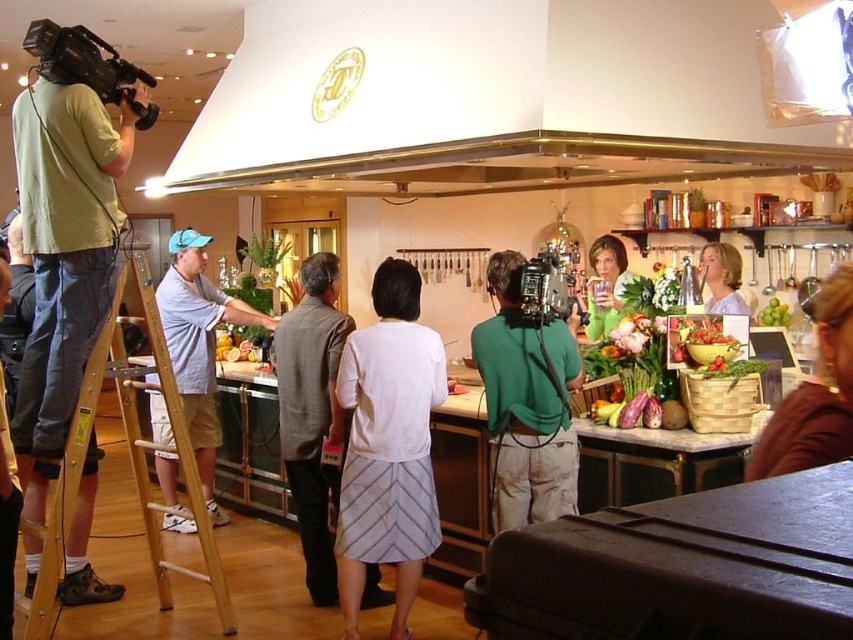
Can you confirm if white textured shirt at center is positioned above wooden ladder at left?

Yes, white textured shirt at center is above wooden ladder at left.

Find the location of a particular element. The height and width of the screenshot is (640, 853). white textured shirt at center is located at coordinates (387, 445).

Who is shorter, black matte video camera at upper left or green leafy vegetables at center?

Standing shorter between the two is green leafy vegetables at center.

Can you confirm if black matte video camera at upper left is positioned to the left of green leafy vegetables at center?

Correct, you'll find black matte video camera at upper left to the left of green leafy vegetables at center.

The height and width of the screenshot is (640, 853). I want to click on black matte video camera at upper left, so click(x=88, y=65).

Is the position of light green t-shirt at left more distant than that of black matte video camera at upper left?

Yes, it is behind black matte video camera at upper left.

Who is more forward, (x=74, y=525) or (x=99, y=70)?

Positioned in front is point (x=99, y=70).

Which is in front, point (97, 150) or point (54, 29)?

Point (54, 29) is more forward.

What are the coordinates of `light green t-shirt at left` in the screenshot? It's located at (67, 227).